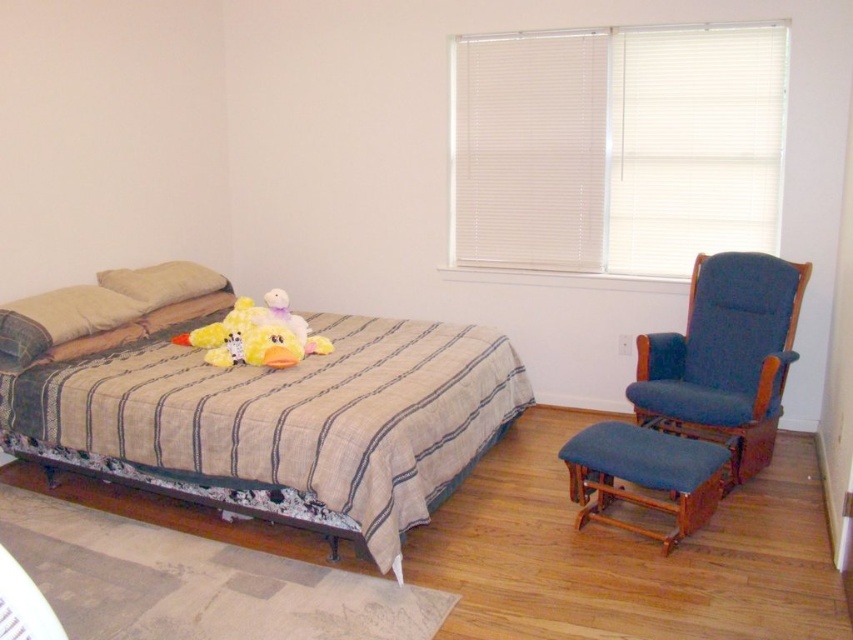
You are a photographer standing in the bedroom and want to take a photo of the striped fabric bed at left. If your camera has a maximum focus range of 2.5 meters, will you be able to capture the bed clearly without moving closer?

The striped fabric bed at left and camera are 2.49 meters apart from each other, so yes, the camera can focus on the bed clearly since the distance is within its maximum focus range of 2.5 meters.

You are standing in the bedroom and want to touch the striped fabric bed at left. If you move straight towards the point at coordinates (x=276, y=413), will you be touching the striped fabric bed at left?

Yes, because the point at coordinates (x=276, y=413) corresponds to the striped fabric bed at left according to the description.

You are a delivery robot that is 18 inches wide. You need to move from the doorway to the bed while avoiding obstacles. Is there enough space between the beige fabric pillow at left and the yellow plush duck at center for you to pass through?

The distance between the beige fabric pillow at left and the yellow plush duck at center is 23.59 inches. Since the robot is 18 inches wide, there is sufficient space for it to pass through the gap between them.